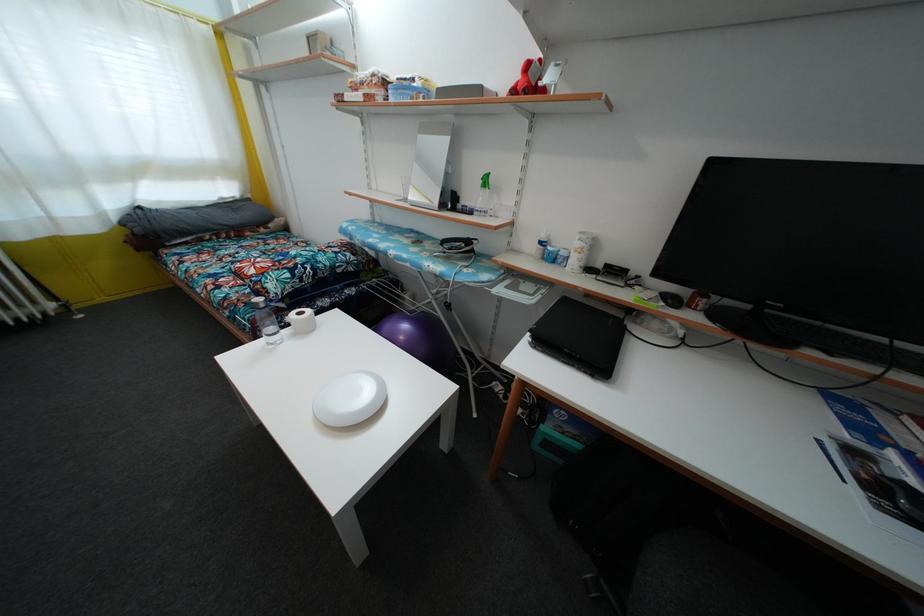
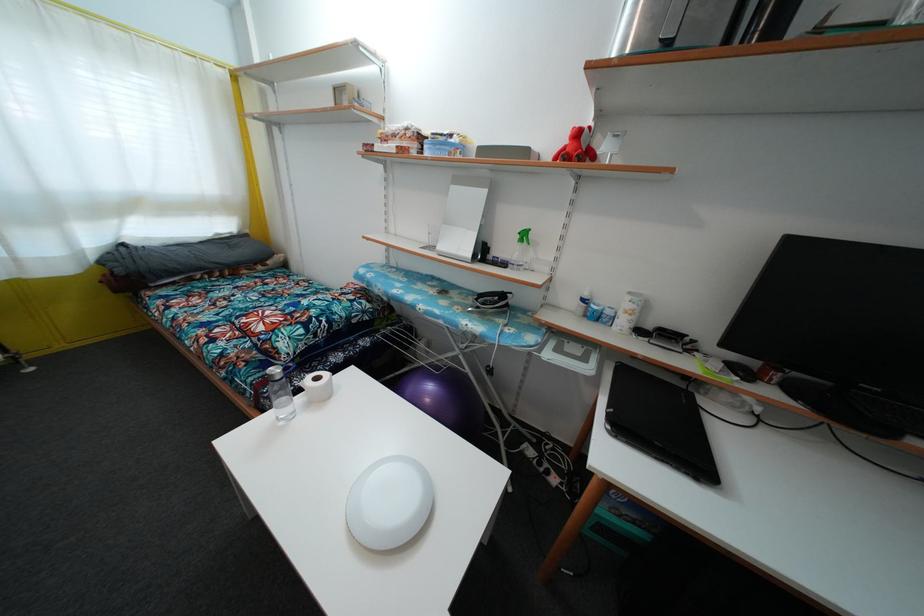
Where in the second image is the point corresponding to point (489, 187) from the first image?

(528, 241)